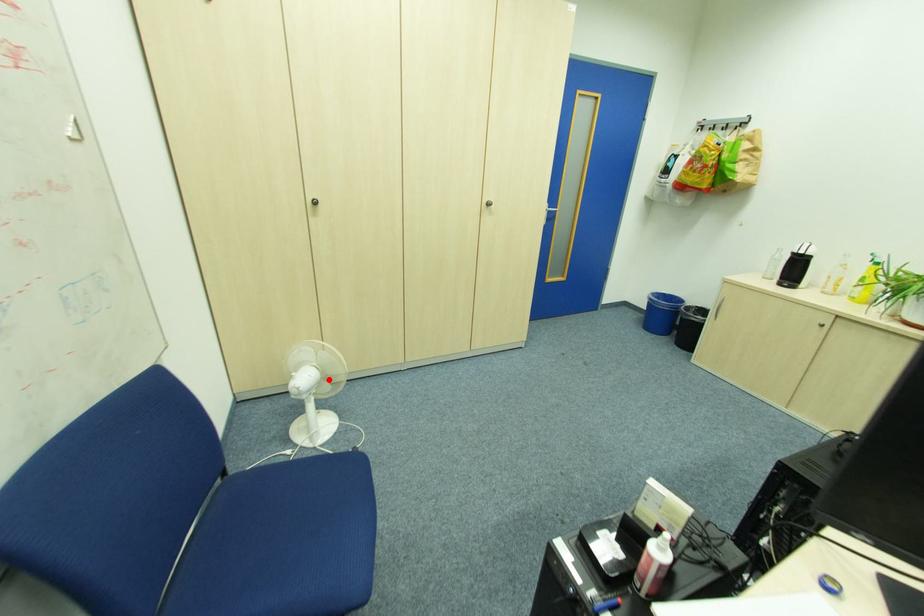
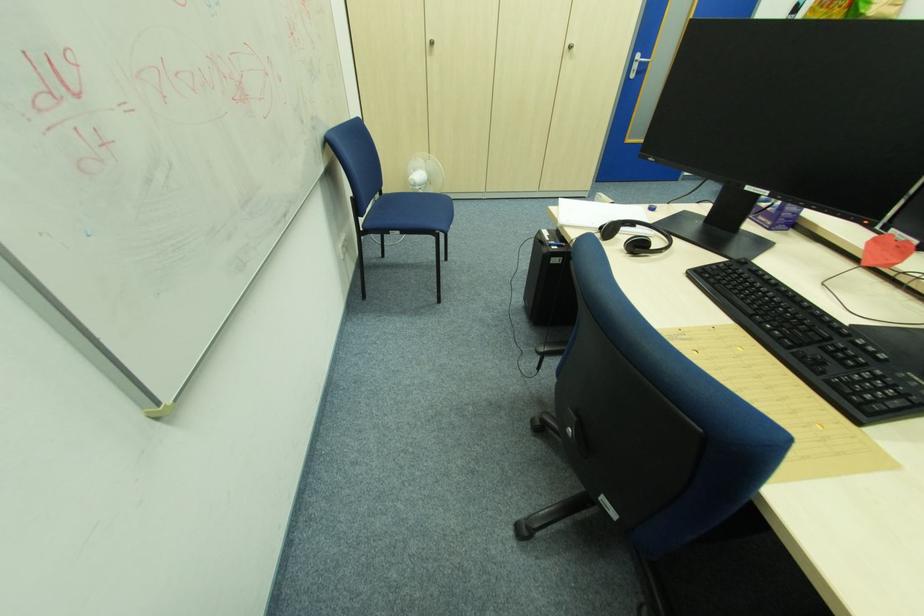
Question: I am providing you with two images of the same scene from different viewpoints. Given a red point in image1, look at the same physical point in image2. Is it:

Choices:
 (A) Closer to the viewpoint
 (B) Farther from the viewpoint

Answer: (B)